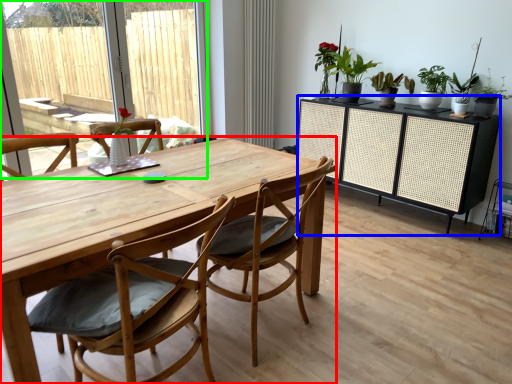
Question: Considering the real-world distances, which object is farthest from table (highlighted by a red box)? cabinetry (highlighted by a blue box) or window screen (highlighted by a green box)?

Choices:
 (A) cabinetry
 (B) window screen

Answer: (B)